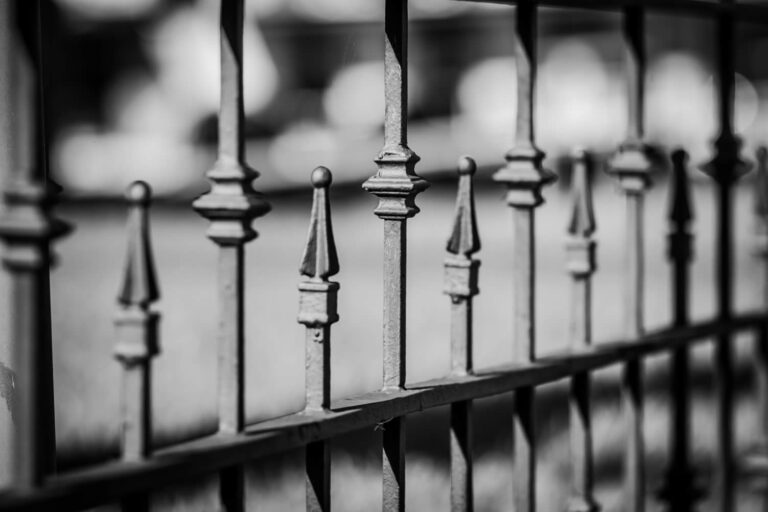
Where is `rod`? rod is located at coordinates (680, 306).